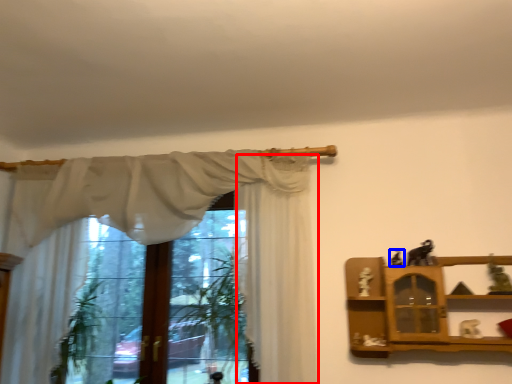
Question: Which point is further to the camera, curtain (highlighted by a red box) or toy (highlighted by a blue box)?

Choices:
 (A) curtain
 (B) toy

Answer: (B)